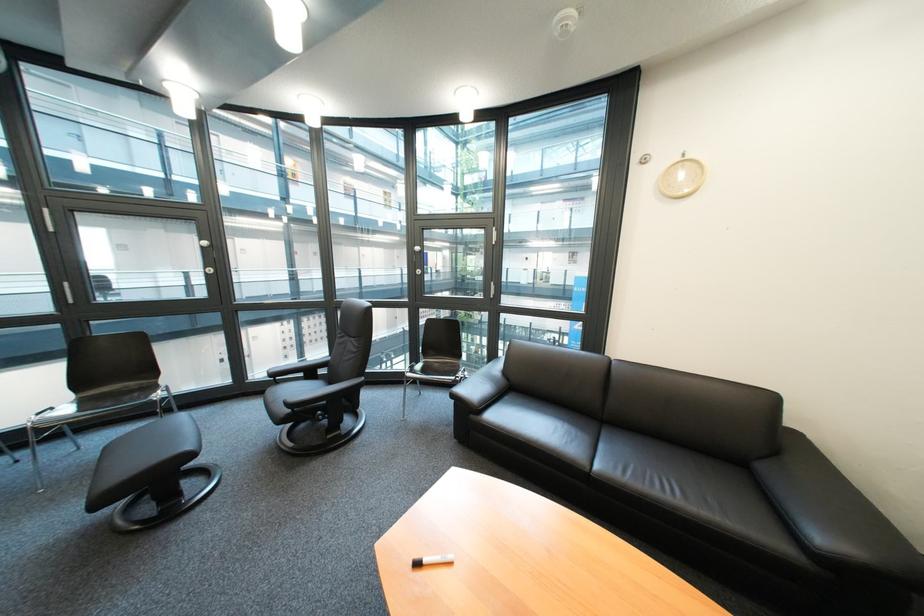
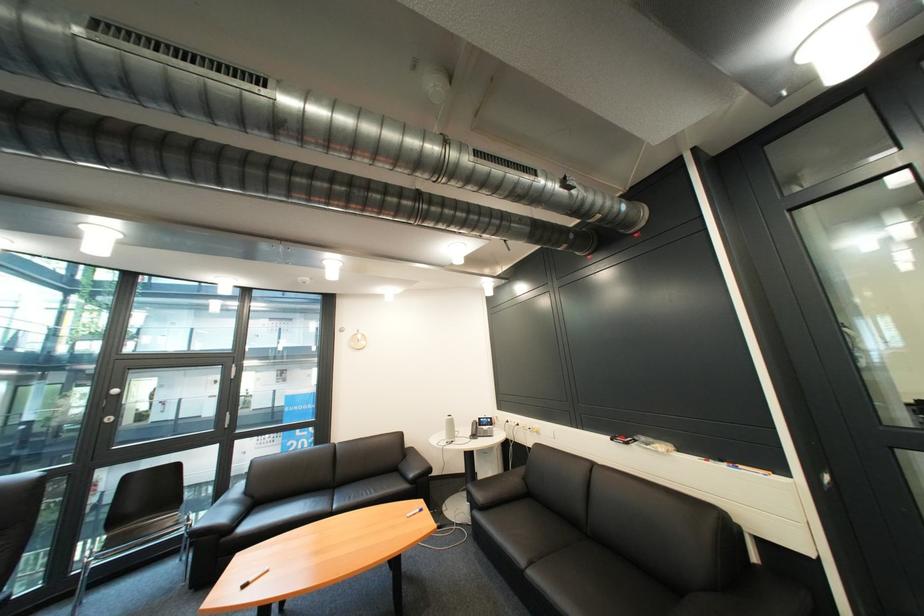
The point at (x=517, y=384) is marked in the first image. Where is the corresponding point in the second image?

(262, 503)